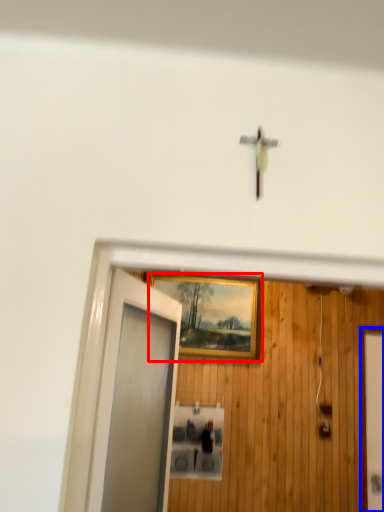
Question: Which of the following is the farthest to the observer, picture frame (highlighted by a red box) or elevator door (highlighted by a blue box)?

Choices:
 (A) picture frame
 (B) elevator door

Answer: (A)